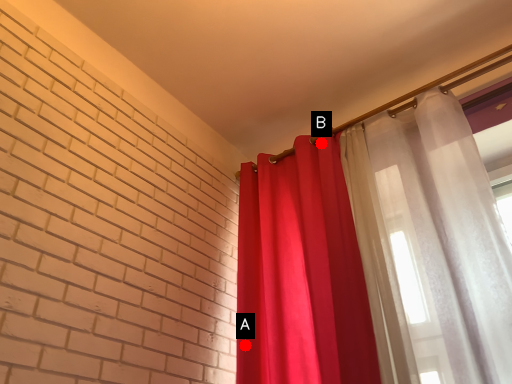
Question: Two points are circled on the image, labeled by A and B beside each circle. Which point is further to the camera?

Choices:
 (A) A is further
 (B) B is further

Answer: (B)